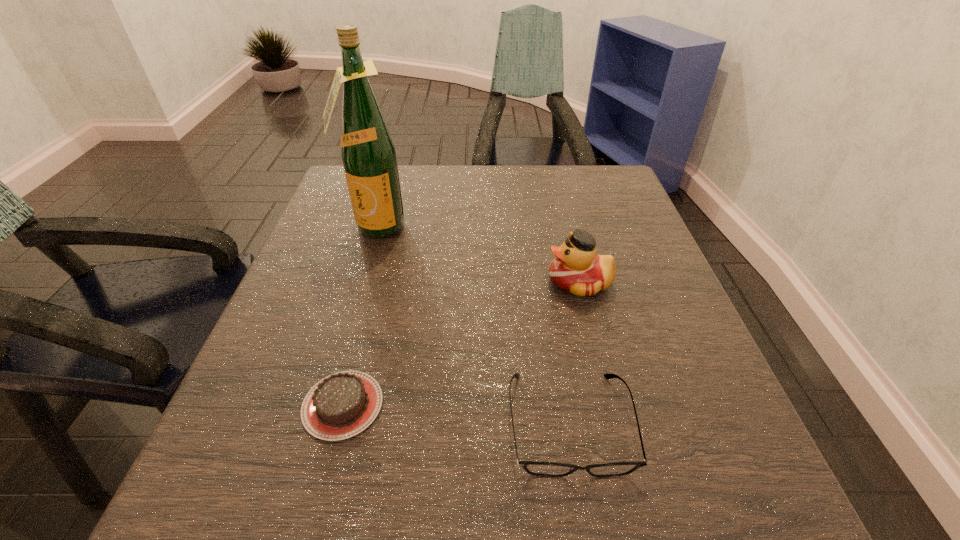
Where is `the farthest object`? the farthest object is located at coordinates (368, 154).

In order to click on the tallest object in this screenshot , I will do `click(368, 154)`.

The width and height of the screenshot is (960, 540). Find the location of `duck`. duck is located at coordinates (577, 269).

Locate an element on the screen. This screenshot has width=960, height=540. the third nearest object is located at coordinates (577, 269).

At what (x,y) coordinates should I click in order to perform the action: click on the third tallest object. Please return your answer as a coordinate pair (x, y). Image resolution: width=960 pixels, height=540 pixels. Looking at the image, I should click on (547, 469).

You are a GUI agent. You are given a task and a screenshot of the screen. Output one action in this format:
    pyautogui.click(x=<x>, y=<y>)
    Task: Click on the chocolate cake
    The image size is (960, 540).
    Given the screenshot: What is the action you would take?
    pyautogui.click(x=341, y=405)

What are the coordinates of `free location located 0.120m on the front-facing side of the farthest object` in the screenshot? It's located at (359, 281).

Locate an element on the screen. The image size is (960, 540). free spot located on the face of the second farthest object is located at coordinates (372, 282).

You are a GUI agent. You are given a task and a screenshot of the screen. Output one action in this format:
    pyautogui.click(x=<x>, y=<y>)
    Task: Click on the vacant space situated 0.090m on the face of the second farthest object
    
    Given the screenshot: What is the action you would take?
    pyautogui.click(x=500, y=282)

I want to click on free space located 0.210m on the face of the second farthest object, so click(x=439, y=282).